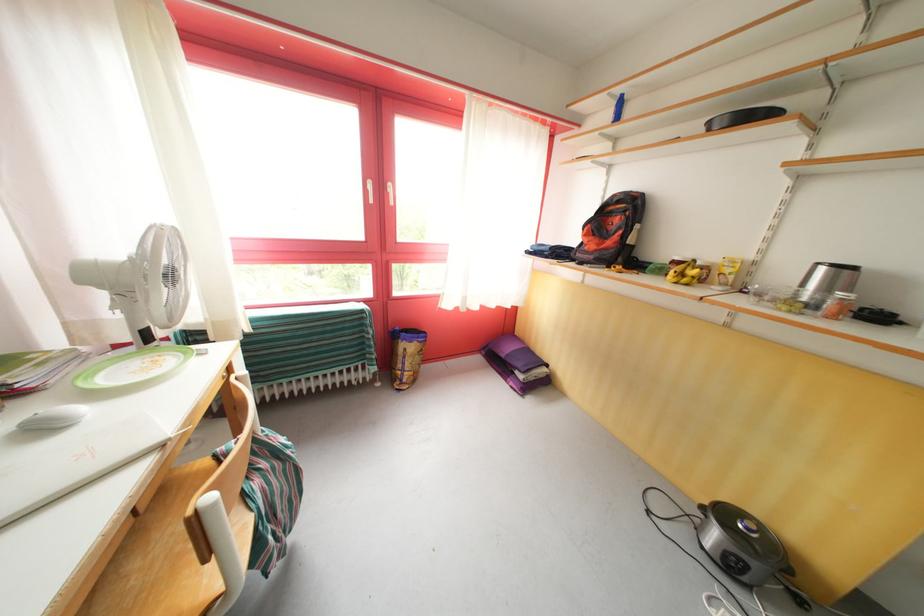
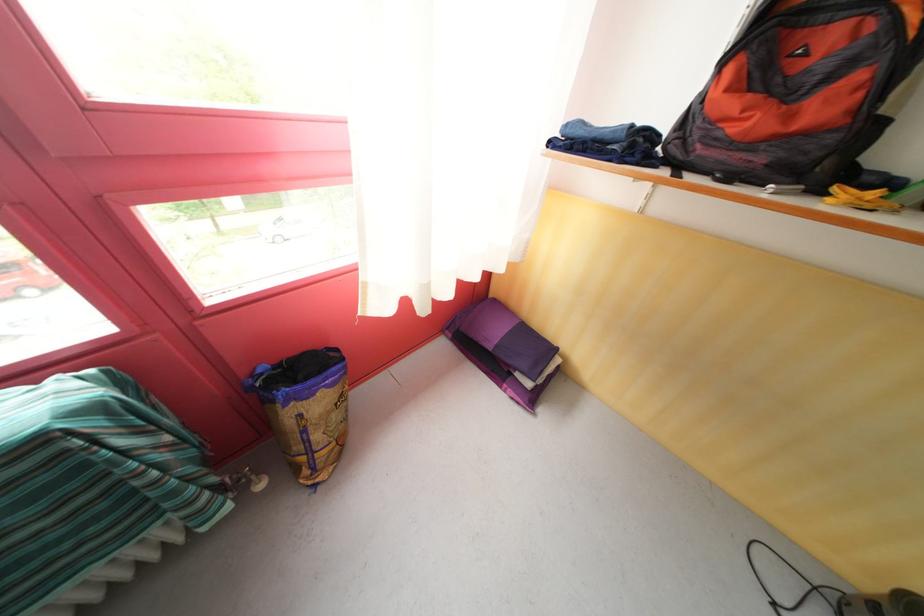
Locate, in the second image, the point that corresponds to point (407, 371) in the first image.

(305, 454)